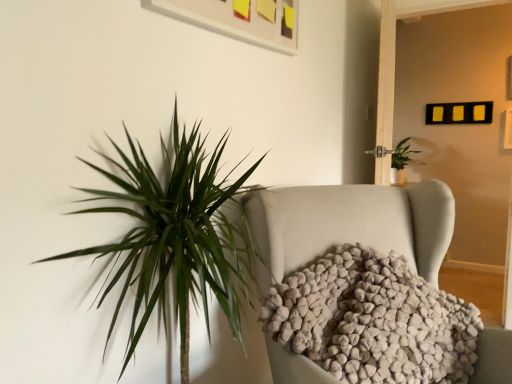
Question: Do you think green leafy plant at upper right is within white fuzzy blanket at center, or outside of it?

Choices:
 (A) inside
 (B) outside

Answer: (B)

Question: Is green leafy plant at upper right to the left or to the right of white fuzzy blanket at center in the image?

Choices:
 (A) left
 (B) right

Answer: (B)

Question: Is green leafy plant at upper right wider or thinner than white fuzzy blanket at center?

Choices:
 (A) wide
 (B) thin

Answer: (A)

Question: From the image's perspective, is white fuzzy blanket at center positioned above or below green leafy plant at upper right?

Choices:
 (A) above
 (B) below

Answer: (B)

Question: Is point (422, 238) positioned closer to the camera than point (406, 142)?

Choices:
 (A) farther
 (B) closer

Answer: (B)

Question: Is white fuzzy blanket at center bigger or smaller than green leafy plant at upper right?

Choices:
 (A) big
 (B) small

Answer: (A)

Question: Is white fuzzy blanket at center wider or thinner than green leafy plant at upper right?

Choices:
 (A) wide
 (B) thin

Answer: (B)